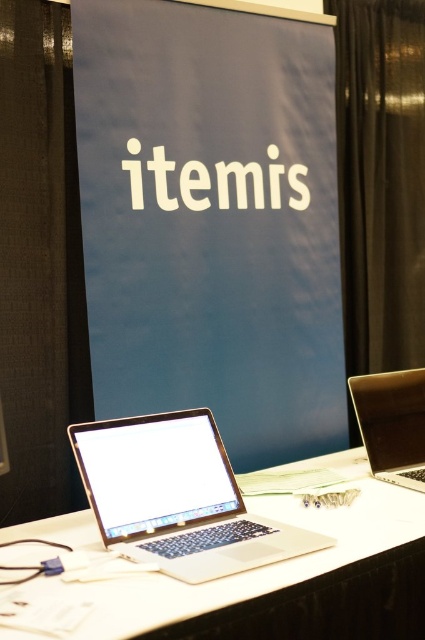
Is white matte laptop at center below satin silver laptop at center?

Correct, white matte laptop at center is located below satin silver laptop at center.

Is white matte laptop at center shorter than satin silver laptop at center?

Indeed, white matte laptop at center has a lesser height compared to satin silver laptop at center.

Where is `white matte laptop at center`? This screenshot has width=425, height=640. white matte laptop at center is located at coordinates (255, 568).

Locate an element on the screen. This screenshot has width=425, height=640. white matte laptop at center is located at coordinates (255, 568).

Which is in front, point (116, 360) or point (95, 632)?

Point (95, 632)

Between point (164, 227) and point (172, 604), which one is positioned behind?

The point (164, 227) is behind.

Which is in front, point (300, 156) or point (356, 531)?

Point (356, 531) is more forward.

You are a GUI agent. You are given a task and a screenshot of the screen. Output one action in this format:
    pyautogui.click(x=<x>, y=<y>)
    Task: Click on the blue matte signboard at center
    
    Given the screenshot: What is the action you would take?
    point(212,220)

Can you confirm if blue matte signboard at center is positioned to the right of silver metallic laptop at center?

Correct, you'll find blue matte signboard at center to the right of silver metallic laptop at center.

Who is positioned more to the left, blue matte signboard at center or silver metallic laptop at center?

silver metallic laptop at center

Is point (260, 160) positioned after point (220, 557)?

Yes, it is behind point (220, 557).

The height and width of the screenshot is (640, 425). I want to click on blue matte signboard at center, so click(x=212, y=220).